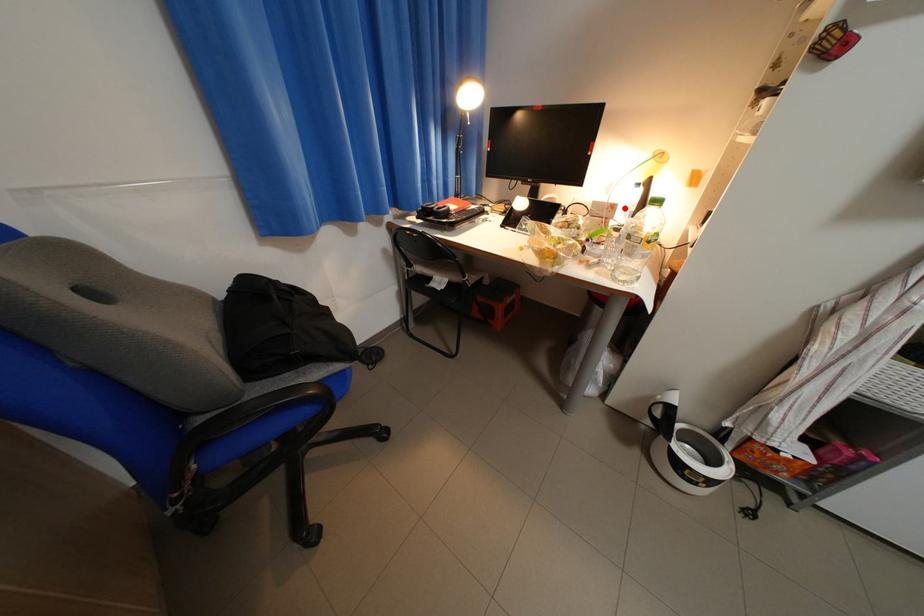
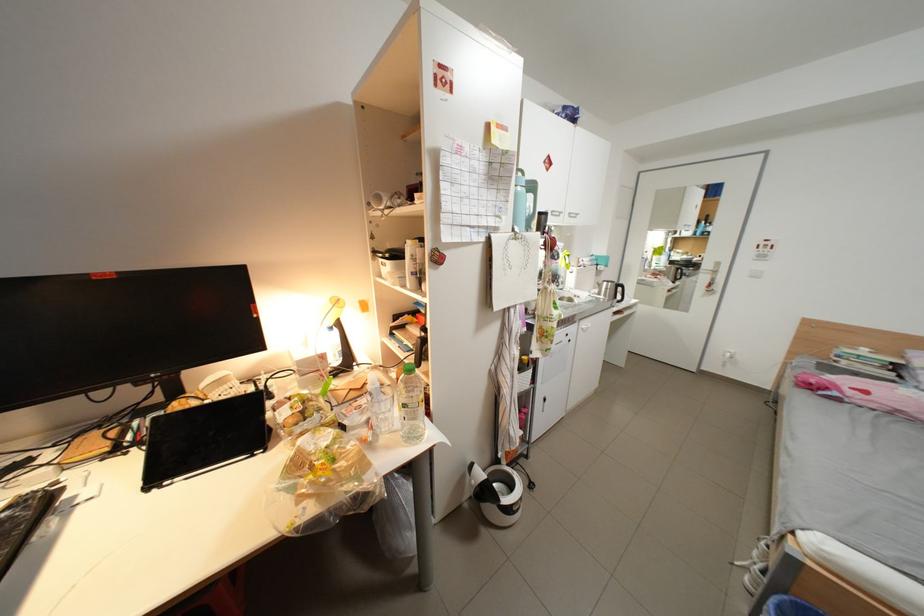
Locate, in the second image, the point that corresponds to the highlighted location in the first image.

(334, 358)